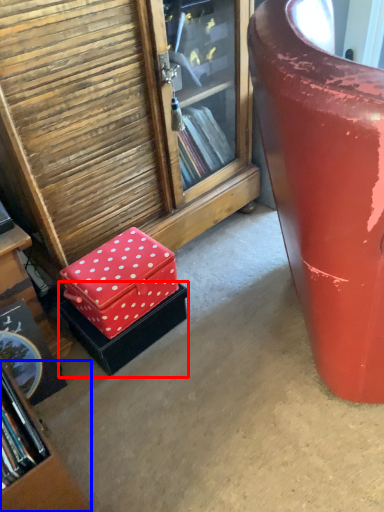
Question: Which object appears closest to the camera in this image, box (highlighted by a red box) or bookcase (highlighted by a blue box)?

Choices:
 (A) box
 (B) bookcase

Answer: (B)